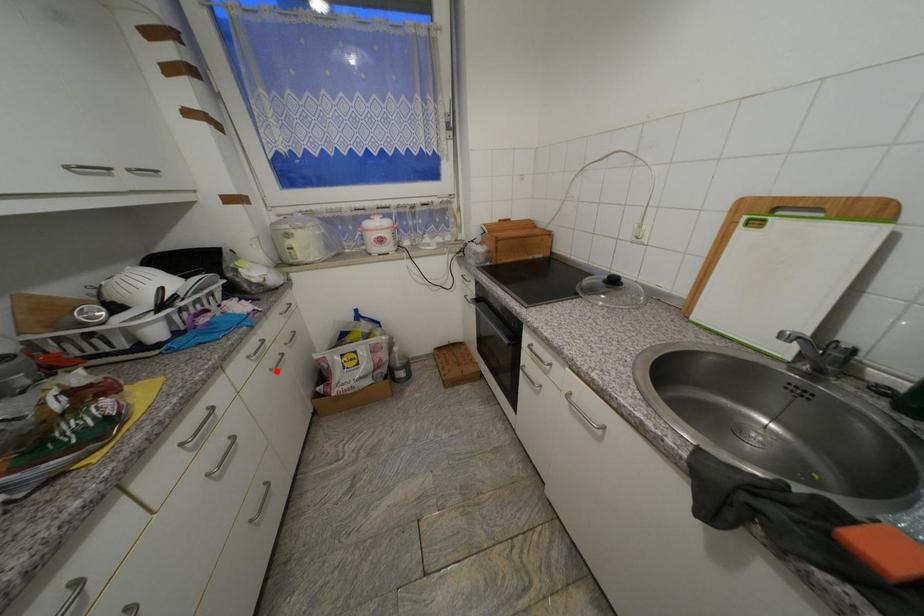
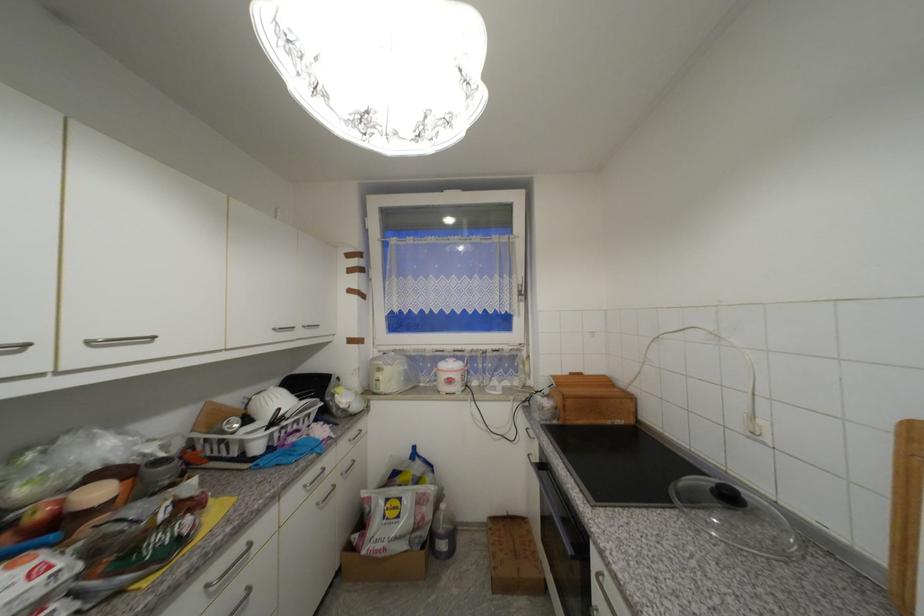
Question: I am providing you with two images of the same scene from different viewpoints. A red point is shown in image1. For the corresponding object point in image2, is it positioned nearer or farther from the camera?

Choices:
 (A) Nearer
 (B) Farther

Answer: (B)